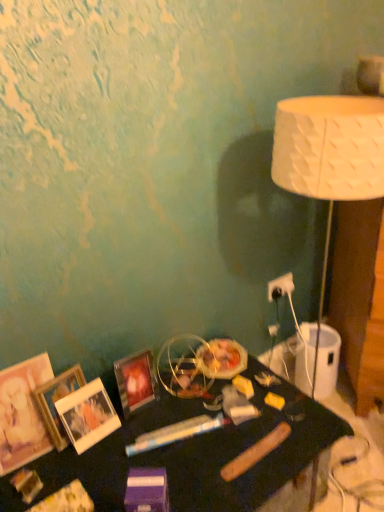
Identify the location of free spot above black glossy table at lower center (from a real-world perspective). The image size is (384, 512). (177, 429).